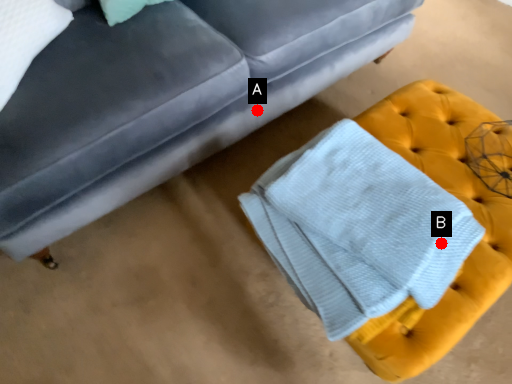
Question: Two points are circled on the image, labeled by A and B beside each circle. Which point appears farthest from the camera in this image?

Choices:
 (A) A is further
 (B) B is further

Answer: (A)